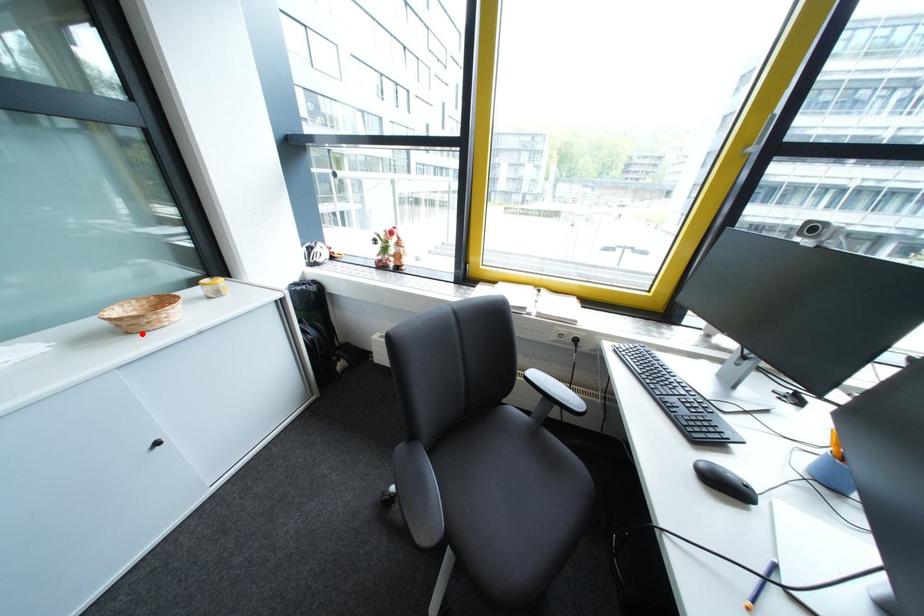
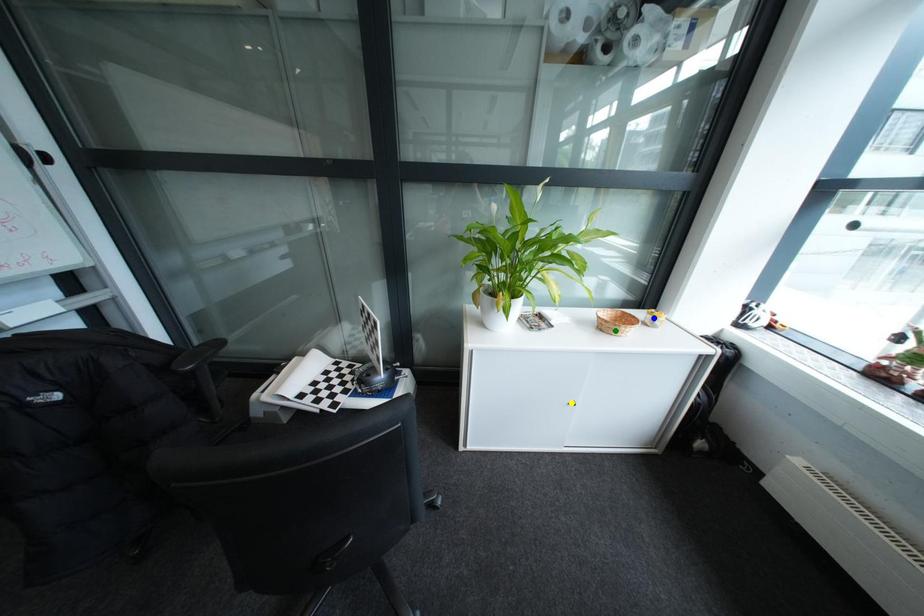
Question: I am providing you with two images of the same scene from different viewpoints. A red point is marked on the first image. You are given multiple points on the second image. Which point in image 2 represents the same 3d spot as the red point in image 1?

Choices:
 (A) yellow point
 (B) green point
 (C) blue point

Answer: (B)